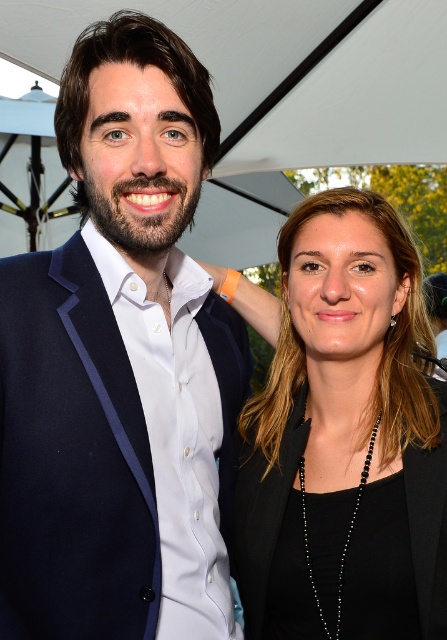
From the picture: Does matte blue suit at left appear on the left side of black matte blazer at center?

Yes, matte blue suit at left is to the left of black matte blazer at center.

The image size is (447, 640). I want to click on matte blue suit at left, so click(122, 365).

The width and height of the screenshot is (447, 640). Find the location of `matte blue suit at left`. matte blue suit at left is located at coordinates (122, 365).